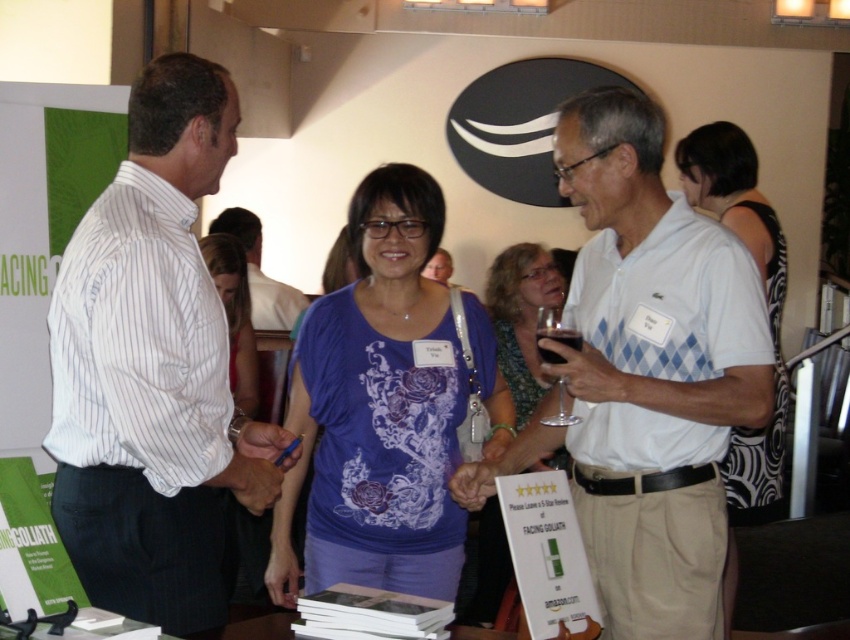
Question: Which point is closer to the camera?

Choices:
 (A) white argyle shirt at center
 (B) blue printed shirt at center
 (C) printed black dress at center

Answer: (A)

Question: Which object is the closest to the translucent glass at center?

Choices:
 (A) printed black dress at center
 (B) purple printed shirt at center
 (C) transparent glass at center
 (D) matte purple shirt at center

Answer: (C)

Question: Is blue printed shirt at center positioned before translucent glass at center?

Choices:
 (A) yes
 (B) no

Answer: (B)

Question: Is matte purple shirt at center thinner than transparent glass at center?

Choices:
 (A) no
 (B) yes

Answer: (A)

Question: Can you confirm if matte purple shirt at center is positioned above transparent glass at center?

Choices:
 (A) no
 (B) yes

Answer: (A)

Question: Which point is farther to the camera?

Choices:
 (A) (x=769, y=410)
 (B) (x=717, y=180)
 (C) (x=550, y=362)

Answer: (B)